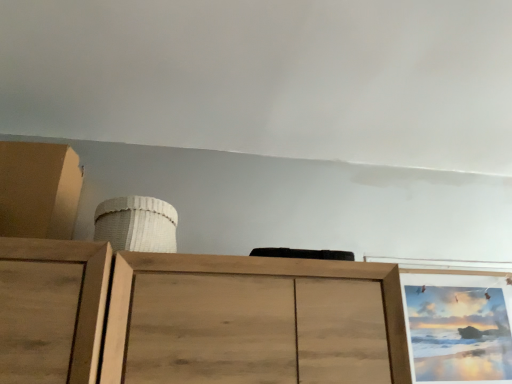
Question: From a real-world perspective, is wooden picture frame at upper right located beneath matte brown cabinet at upper left?

Choices:
 (A) no
 (B) yes

Answer: (B)

Question: Does wooden picture frame at upper right lie in front of matte brown cabinet at upper left?

Choices:
 (A) no
 (B) yes

Answer: (A)

Question: Is wooden picture frame at upper right completely or partially outside of matte brown cabinet at upper left?

Choices:
 (A) yes
 (B) no

Answer: (A)

Question: Does wooden picture frame at upper right have a lesser width compared to matte brown cabinet at upper left?

Choices:
 (A) yes
 (B) no

Answer: (A)

Question: Considering the relative sizes of wooden picture frame at upper right and matte brown cabinet at upper left in the image provided, is wooden picture frame at upper right wider than matte brown cabinet at upper left?

Choices:
 (A) yes
 (B) no

Answer: (B)

Question: From a real-world perspective, is matte brown cabinet at upper left positioned above or below white woven basket at upper center?

Choices:
 (A) above
 (B) below

Answer: (A)

Question: From the image's perspective, is matte brown cabinet at upper left above or below white woven basket at upper center?

Choices:
 (A) above
 (B) below

Answer: (A)

Question: Does point (0, 185) appear closer or farther from the camera than point (144, 208)?

Choices:
 (A) closer
 (B) farther

Answer: (B)

Question: Based on their sizes in the image, would you say matte brown cabinet at upper left is bigger or smaller than white woven basket at upper center?

Choices:
 (A) big
 (B) small

Answer: (A)

Question: From the image's perspective, is wooden picture frame at upper right located above or below white woven basket at upper center?

Choices:
 (A) above
 (B) below

Answer: (B)

Question: Relative to white woven basket at upper center, is wooden picture frame at upper right in front or behind?

Choices:
 (A) front
 (B) behind

Answer: (B)

Question: Considering the positions of point (472, 294) and point (162, 221), is point (472, 294) closer or farther from the camera than point (162, 221)?

Choices:
 (A) farther
 (B) closer

Answer: (A)

Question: Visually, is wooden picture frame at upper right positioned to the left or to the right of white woven basket at upper center?

Choices:
 (A) left
 (B) right

Answer: (B)

Question: In terms of width, does matte brown cabinet at upper left look wider or thinner when compared to wooden picture frame at upper right?

Choices:
 (A) thin
 (B) wide

Answer: (B)

Question: Considering the positions of matte brown cabinet at upper left and wooden picture frame at upper right in the image, is matte brown cabinet at upper left taller or shorter than wooden picture frame at upper right?

Choices:
 (A) tall
 (B) short

Answer: (B)